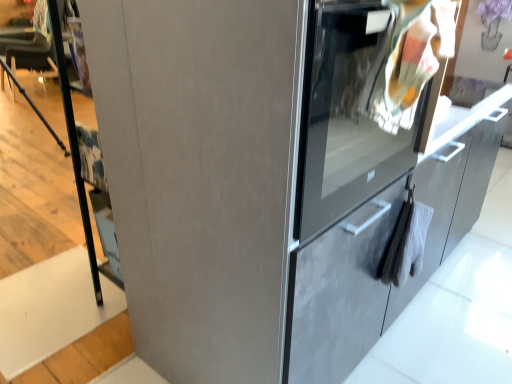
Image resolution: width=512 pixels, height=384 pixels. Find the location of `empty space that is ontop of white matte stair at lower left (from a real-world perspective)`. empty space that is ontop of white matte stair at lower left (from a real-world perspective) is located at coordinates (40, 307).